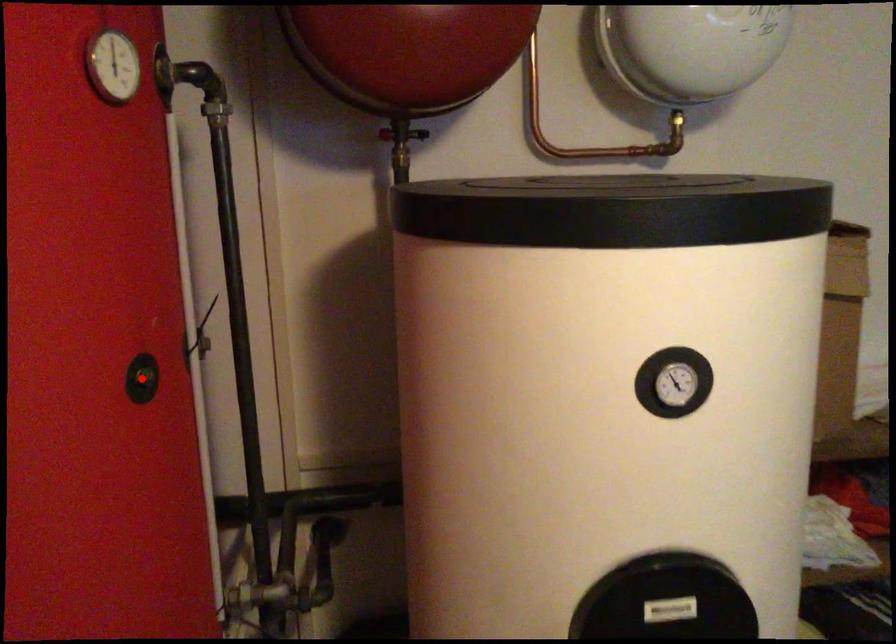
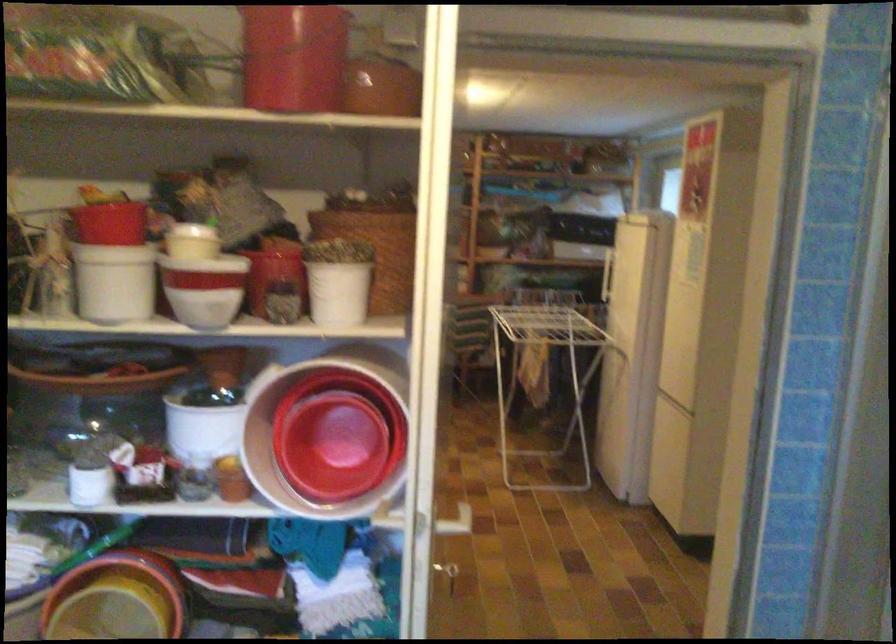
Question: I am providing you with two images of the same scene from different viewpoints. A red point is marked on the first image. At the location where the point appears in image 1, is it still visible in image 2?

Choices:
 (A) Yes
 (B) No

Answer: (B)